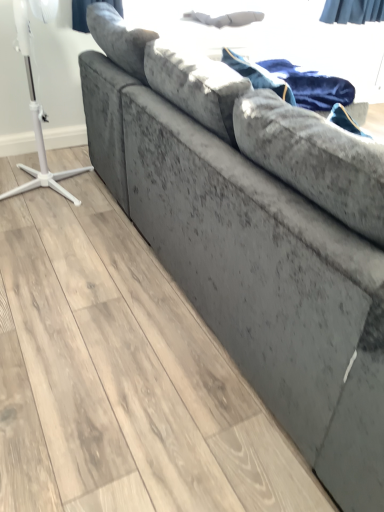
Identify the location of velvet blue blanket at upper right. The height and width of the screenshot is (512, 384). (311, 86).

In order to face velvet blue blanket at upper right, should I rotate leftwards or rightwards?

Rotate right and turn 13.610 degrees.

Describe the element at coordinates (311, 86) in the screenshot. The height and width of the screenshot is (512, 384). I see `velvet blue blanket at upper right` at that location.

In order to click on white plastic tripod at left in this screenshot , I will do `click(37, 120)`.

This screenshot has width=384, height=512. What do you see at coordinates (37, 120) in the screenshot?
I see `white plastic tripod at left` at bounding box center [37, 120].

This screenshot has height=512, width=384. In order to click on velvet blue blanket at upper right in this screenshot , I will do `click(311, 86)`.

Which is more to the left, white plastic tripod at left or velvet blue blanket at upper right?

white plastic tripod at left.

Considering the positions of objects white plastic tripod at left and velvet blue blanket at upper right in the image provided, who is behind, white plastic tripod at left or velvet blue blanket at upper right?

velvet blue blanket at upper right is more distant.

Which is further, (3, 194) or (343, 85)?

Point (3, 194)

From the image's perspective, which one is positioned higher, white plastic tripod at left or velvet blue blanket at upper right?

velvet blue blanket at upper right is shown above in the image.

From a real-world perspective, who is located higher, white plastic tripod at left or velvet blue blanket at upper right?

From a 3D spatial view, velvet blue blanket at upper right is above.

Does white plastic tripod at left have a greater width compared to velvet blue blanket at upper right?

Incorrect, the width of white plastic tripod at left does not surpass that of velvet blue blanket at upper right.

In terms of height, does white plastic tripod at left look taller or shorter compared to velvet blue blanket at upper right?

In the image, white plastic tripod at left appears to be taller than velvet blue blanket at upper right.

Based on the photo, based on their sizes in the image, would you say white plastic tripod at left is bigger or smaller than velvet blue blanket at upper right?

In the image, white plastic tripod at left appears to be larger than velvet blue blanket at upper right.

Does white plastic tripod at left contain velvet blue blanket at upper right?

No.

Is white plastic tripod at left placed right next to velvet blue blanket at upper right?

Result: No, white plastic tripod at left is not making contact with velvet blue blanket at upper right.

Is white plastic tripod at left turned away from velvet blue blanket at upper right?

No.

Where is `table lamp on the left of velvet blue blanket at upper right`? The image size is (384, 512). table lamp on the left of velvet blue blanket at upper right is located at coordinates (37, 120).

Which is more to the right, velvet blue blanket at upper right or white plastic tripod at left?

velvet blue blanket at upper right is more to the right.

In the scene shown: Is the depth of velvet blue blanket at upper right greater than that of white plastic tripod at left?

That is True.

Is point (335, 94) positioned behind point (37, 123)?

No.

From the image's perspective, between velvet blue blanket at upper right and white plastic tripod at left, who is located below?

From the image's view, white plastic tripod at left is below.

From a real-world perspective, between velvet blue blanket at upper right and white plastic tripod at left, who is vertically higher?

velvet blue blanket at upper right is physically above.

Is velvet blue blanket at upper right wider than white plastic tripod at left?

Yes, velvet blue blanket at upper right is wider than white plastic tripod at left.

Does velvet blue blanket at upper right have a greater height compared to white plastic tripod at left?

Incorrect, the height of velvet blue blanket at upper right is not larger of that of white plastic tripod at left.

Considering the sizes of objects velvet blue blanket at upper right and white plastic tripod at left in the image provided, who is smaller, velvet blue blanket at upper right or white plastic tripod at left?

velvet blue blanket at upper right.

Is velvet blue blanket at upper right completely or partially outside of white plastic tripod at left?

Yes, velvet blue blanket at upper right is not within white plastic tripod at left.

Are velvet blue blanket at upper right and white plastic tripod at left making contact?

No, velvet blue blanket at upper right is not touching white plastic tripod at left.

Looking at this image, is velvet blue blanket at upper right looking in the opposite direction of white plastic tripod at left?

Yes.

Can you tell me how much velvet blue blanket at upper right and white plastic tripod at left differ in facing direction?

There is a 5.12-degree angle between the facing directions of velvet blue blanket at upper right and white plastic tripod at left.

Where is `table lamp that is in front of the velvet blue blanket at upper right`? table lamp that is in front of the velvet blue blanket at upper right is located at coordinates (37, 120).

Locate an element on the screen. table lamp in front of the velvet blue blanket at upper right is located at coordinates (37, 120).

Image resolution: width=384 pixels, height=512 pixels. Identify the location of blanket on the right of the white plastic tripod at left. (311, 86).